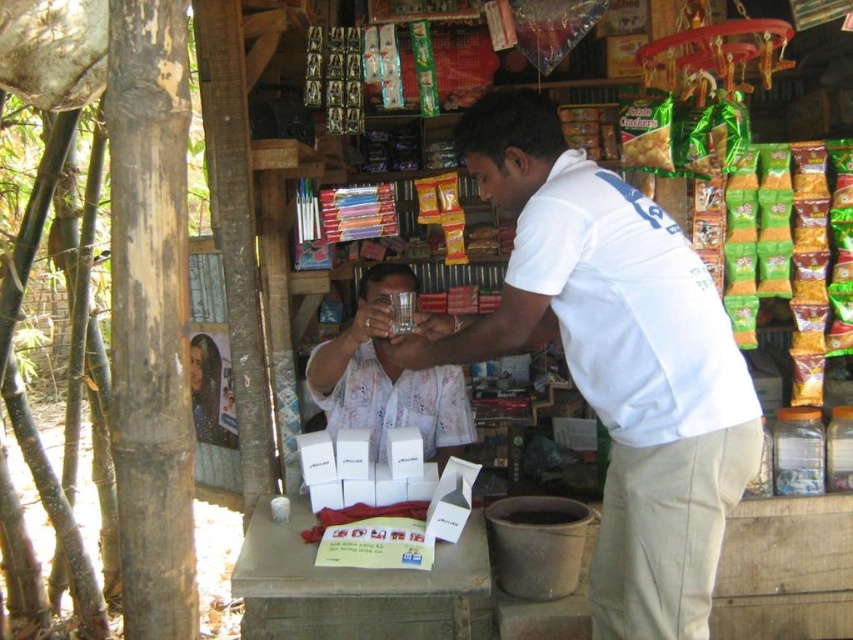
Question: Which of the following is the closest to the observer?

Choices:
 (A) (335, 385)
 (B) (515, 122)

Answer: (B)

Question: Can you confirm if white cotton shirt at center is positioned to the right of white matte glass at center?

Choices:
 (A) yes
 (B) no

Answer: (A)

Question: Is the position of white cotton shirt at center more distant than that of white matte glass at center?

Choices:
 (A) yes
 (B) no

Answer: (B)

Question: Is white cotton shirt at center bigger than white matte glass at center?

Choices:
 (A) no
 (B) yes

Answer: (B)